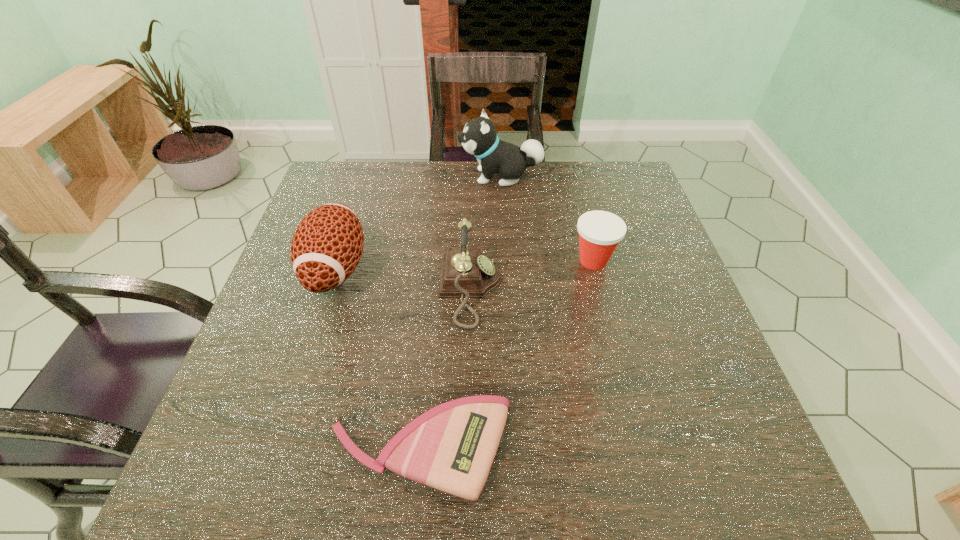
Where is `free space located 0.120m at the face of the tallest object`? The image size is (960, 540). free space located 0.120m at the face of the tallest object is located at coordinates (419, 176).

The height and width of the screenshot is (540, 960). Find the location of `free region located on the right of the leftmost object`. free region located on the right of the leftmost object is located at coordinates (401, 269).

In order to click on free location located 0.350m on the dial of the telephone in this screenshot , I will do `click(657, 289)`.

You are a GUI agent. You are given a task and a screenshot of the screen. Output one action in this format:
    pyautogui.click(x=<x>, y=<y>)
    Task: Click on the vacant space situated on the front of the Dixie cup
    The width and height of the screenshot is (960, 540).
    Given the screenshot: What is the action you would take?
    pyautogui.click(x=608, y=317)

I want to click on vacant area located 0.250m on the right of the nearest object, so click(659, 450).

Locate an element on the screen. The image size is (960, 540). object that is at the far edge is located at coordinates (479, 138).

Image resolution: width=960 pixels, height=540 pixels. Identify the location of object present at the near edge. (451, 447).

I want to click on object present at the left edge, so click(326, 248).

You are a GUI agent. You are given a task and a screenshot of the screen. Output one action in this format:
    pyautogui.click(x=<x>, y=<y>)
    Task: Click on the object at the right edge
    Image resolution: width=960 pixels, height=540 pixels.
    Given the screenshot: What is the action you would take?
    pyautogui.click(x=600, y=232)

Locate an element on the screen. The height and width of the screenshot is (540, 960). vacant area at the far edge of the desktop is located at coordinates (439, 166).